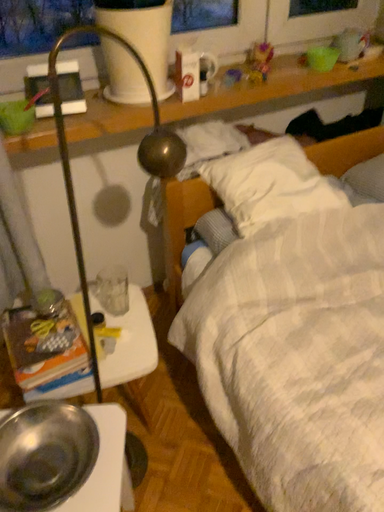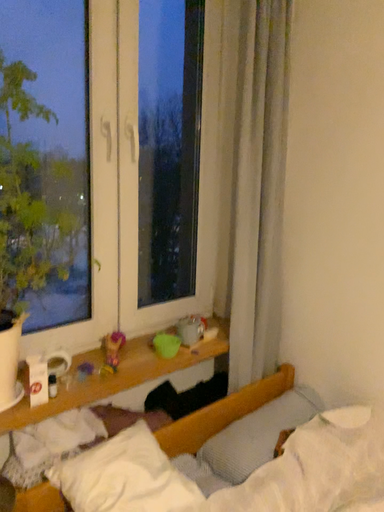
Question: How did the camera likely rotate when shooting the video?

Choices:
 (A) rotated left
 (B) rotated right

Answer: (B)